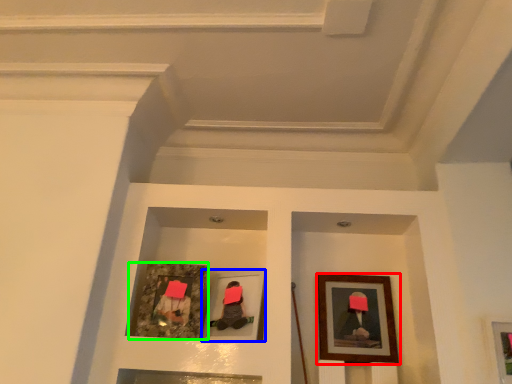
Question: Which object is positioned closest to picture frame (highlighted by a red box)? Select from picture frame (highlighted by a blue box) and picture frame (highlighted by a green box).

Choices:
 (A) picture frame
 (B) picture frame

Answer: (A)